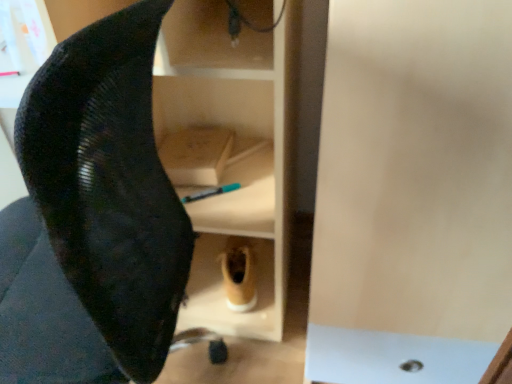
Question: From the image's perspective, is tan suede boot at lower center located beneath black mesh swivel chair at left?

Choices:
 (A) no
 (B) yes

Answer: (B)

Question: Can you confirm if tan suede boot at lower center is bigger than black mesh swivel chair at left?

Choices:
 (A) yes
 (B) no

Answer: (B)

Question: Is tan suede boot at lower center completely or partially outside of black mesh swivel chair at left?

Choices:
 (A) no
 (B) yes

Answer: (B)

Question: Are tan suede boot at lower center and black mesh swivel chair at left located far from each other?

Choices:
 (A) yes
 (B) no

Answer: (B)

Question: Does tan suede boot at lower center have a lesser height compared to black mesh swivel chair at left?

Choices:
 (A) no
 (B) yes

Answer: (B)

Question: From a real-world perspective, is tan suede boot at lower center on black mesh swivel chair at left?

Choices:
 (A) no
 (B) yes

Answer: (A)

Question: Is black mesh swivel chair at left far from tan suede boot at lower center?

Choices:
 (A) yes
 (B) no

Answer: (B)

Question: Is black mesh swivel chair at left thinner than tan suede boot at lower center?

Choices:
 (A) no
 (B) yes

Answer: (A)

Question: Considering the relative positions of black mesh swivel chair at left and tan suede boot at lower center in the image provided, is black mesh swivel chair at left to the right of tan suede boot at lower center from the viewer's perspective?

Choices:
 (A) yes
 (B) no

Answer: (B)

Question: Is black mesh swivel chair at left shorter than tan suede boot at lower center?

Choices:
 (A) yes
 (B) no

Answer: (B)

Question: From a real-world perspective, is black mesh swivel chair at left below tan suede boot at lower center?

Choices:
 (A) no
 (B) yes

Answer: (A)

Question: Is black mesh swivel chair at left positioned before tan suede boot at lower center?

Choices:
 (A) yes
 (B) no

Answer: (A)

Question: Visually, is tan suede boot at lower center positioned to the left or to the right of black mesh swivel chair at left?

Choices:
 (A) left
 (B) right

Answer: (B)